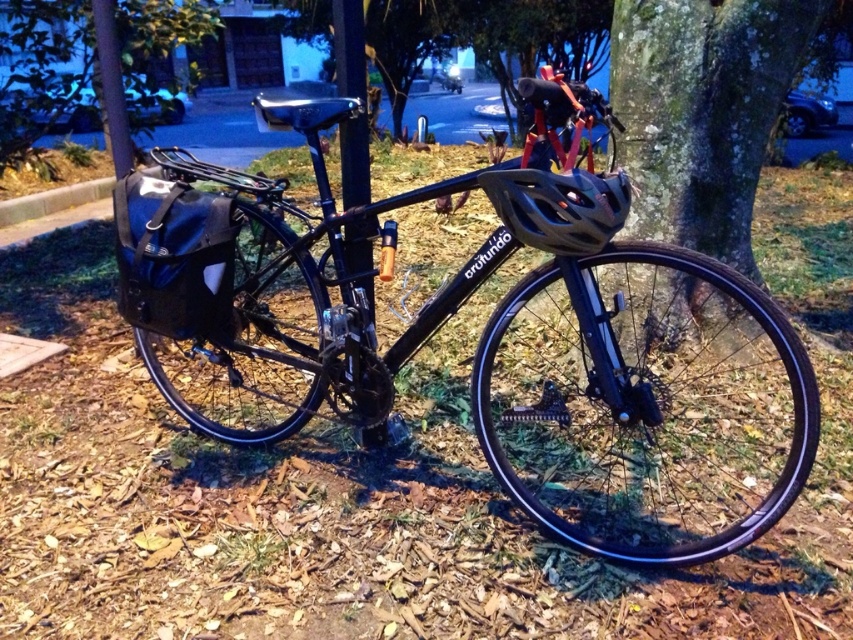
You are a park ranger checking the area. You notice the green mossy bark at center and the metallic pole at upper center. Which object is taller?

The green mossy bark at center is taller than the metallic pole at upper center.

You are a cyclist preparing to ride your black matte bicycle at center. You notice a green leafy tree at center overhead. If you look up while sitting on the bicycle, will the tree be directly above you?

The black matte bicycle at center is below the green leafy tree at center, so when you sit on the bicycle, the green leafy tree at center will be directly above you.

You are a photographer standing 1.8 meters away from the green mossy bark at center. Can you capture the entire tree trunk in your photo without moving closer? Please explain based on the distance provided.

The green mossy bark at center is 2.19 meters away from the camera. Since you are standing 1.8 meters away from it, you are closer than the camera position. Therefore, you can capture the entire tree trunk in your photo without moving closer because your distance is shorter than the camera distance.